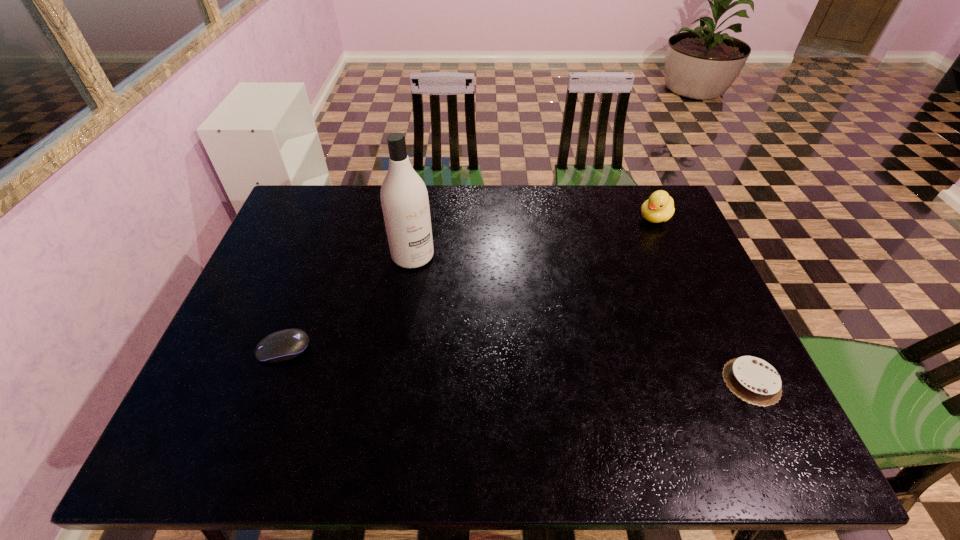
In order to click on the third tallest object in this screenshot , I will do `click(287, 344)`.

Locate an element on the screen. The height and width of the screenshot is (540, 960). the leftmost object is located at coordinates click(x=287, y=344).

The image size is (960, 540). In order to click on chocolate cake in this screenshot , I will do `click(753, 380)`.

Locate an element on the screen. This screenshot has height=540, width=960. the farthest object is located at coordinates (659, 207).

Locate an element on the screen. This screenshot has height=540, width=960. the second tallest object is located at coordinates (659, 207).

Find the location of a particular element. The width and height of the screenshot is (960, 540). the third nearest object is located at coordinates (404, 198).

Locate an element on the screen. This screenshot has width=960, height=540. shampoo is located at coordinates (404, 198).

You are a GUI agent. You are given a task and a screenshot of the screen. Output one action in this format:
    pyautogui.click(x=<x>, y=<y>)
    Task: Click on the free spot located 0.070m on the back of the leftmost object
    The height and width of the screenshot is (540, 960).
    Given the screenshot: What is the action you would take?
    pyautogui.click(x=297, y=313)

I want to click on vacant space positioned 0.060m on the left of the shortest object, so tap(697, 381).

The height and width of the screenshot is (540, 960). What are the coordinates of `free region located on the beak of the duckling` in the screenshot? It's located at (605, 260).